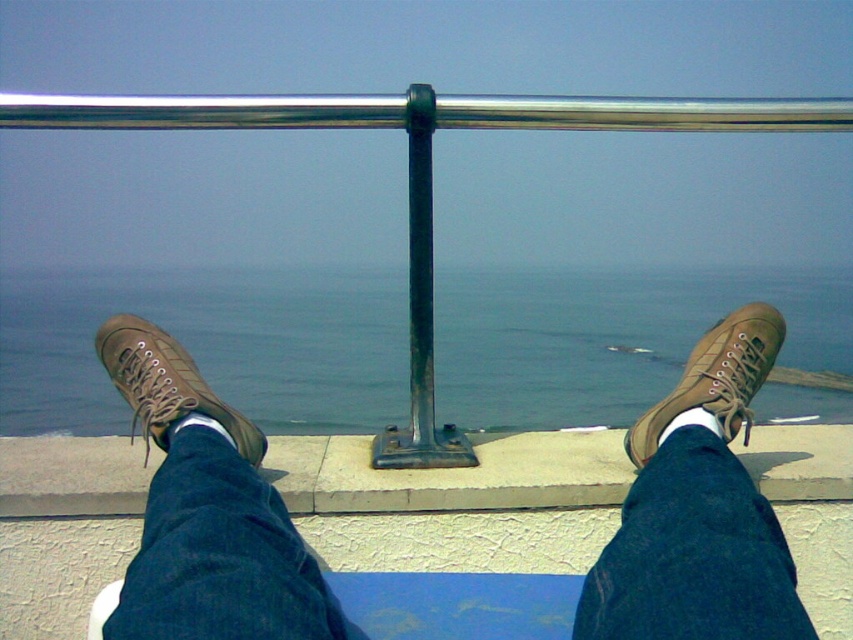
The height and width of the screenshot is (640, 853). What do you see at coordinates (210, 346) in the screenshot?
I see `blue water at center` at bounding box center [210, 346].

Between point (357, 296) and point (254, 444), which one is positioned behind?

Point (357, 296)

The height and width of the screenshot is (640, 853). I want to click on blue water at center, so click(210, 346).

In the scene shown: Does polished metal rail at upper center appear on the left side of brown suede shoe at lower left?

In fact, polished metal rail at upper center is to the right of brown suede shoe at lower left.

Find the location of a particular element. The width and height of the screenshot is (853, 640). polished metal rail at upper center is located at coordinates (422, 173).

Between metallic pole at center and brown suede shoe at center, which one appears on the left side from the viewer's perspective?

metallic pole at center is more to the left.

Who is more distant from viewer, (412, 250) or (757, 365)?

Point (412, 250)

The image size is (853, 640). In order to click on metallic pole at center in this screenshot , I will do `click(421, 312)`.